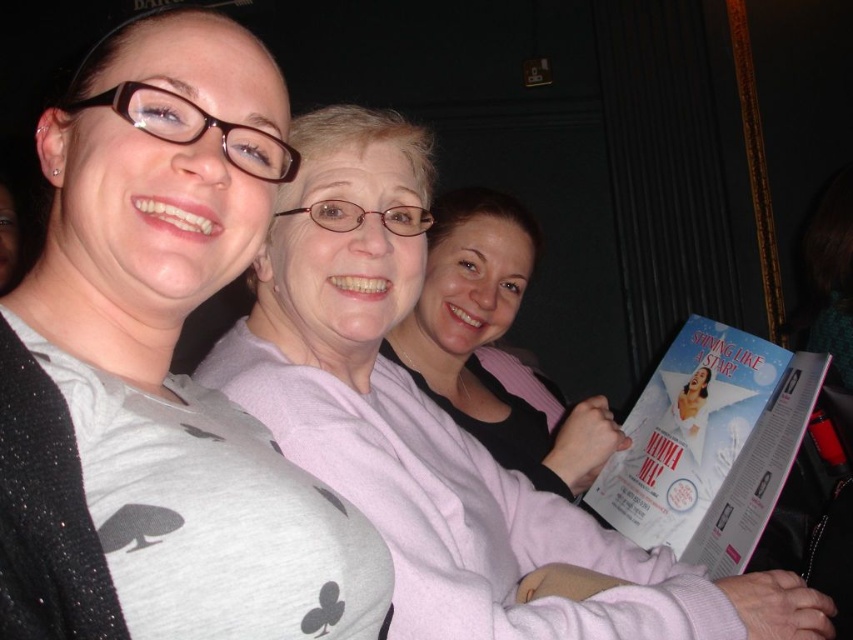
Question: Among these objects, which one is farthest from the camera?

Choices:
 (A) gray matte shirt at upper left
 (B) gray matte sweater at center
 (C) white glossy book at center

Answer: (C)

Question: Is white glossy book at center positioned behind pink fabric sweater at center?

Choices:
 (A) yes
 (B) no

Answer: (B)

Question: Which of the following is the farthest from the observer?

Choices:
 (A) (759, 403)
 (B) (180, 481)
 (C) (460, 390)

Answer: (C)

Question: Which object is the closest to the white glossy book at center?

Choices:
 (A) gray matte shirt at upper left
 (B) gray matte sweater at center

Answer: (B)

Question: Is gray matte shirt at upper left bigger than white glossy book at center?

Choices:
 (A) yes
 (B) no

Answer: (B)

Question: Does gray matte sweater at center have a lesser width compared to pink fabric sweater at center?

Choices:
 (A) no
 (B) yes

Answer: (A)